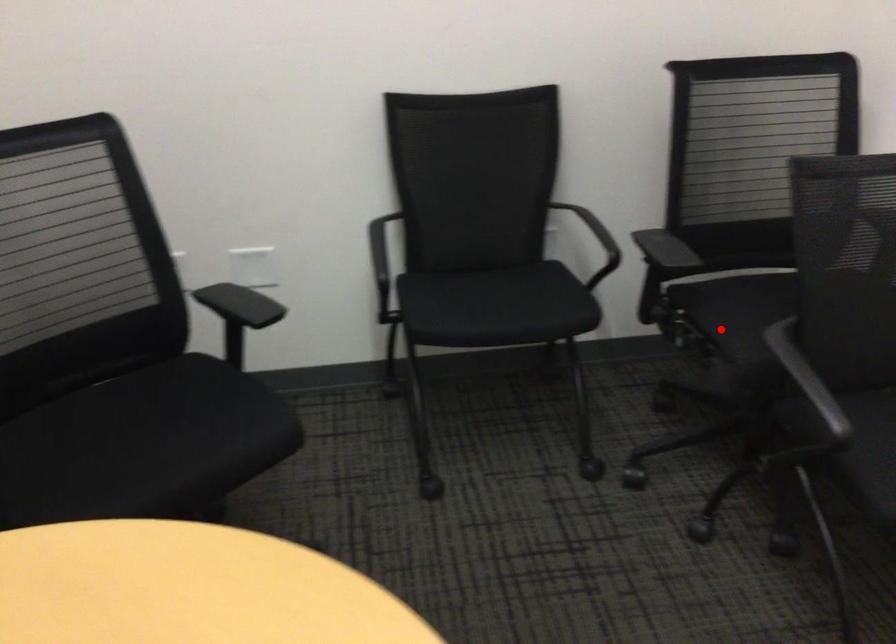
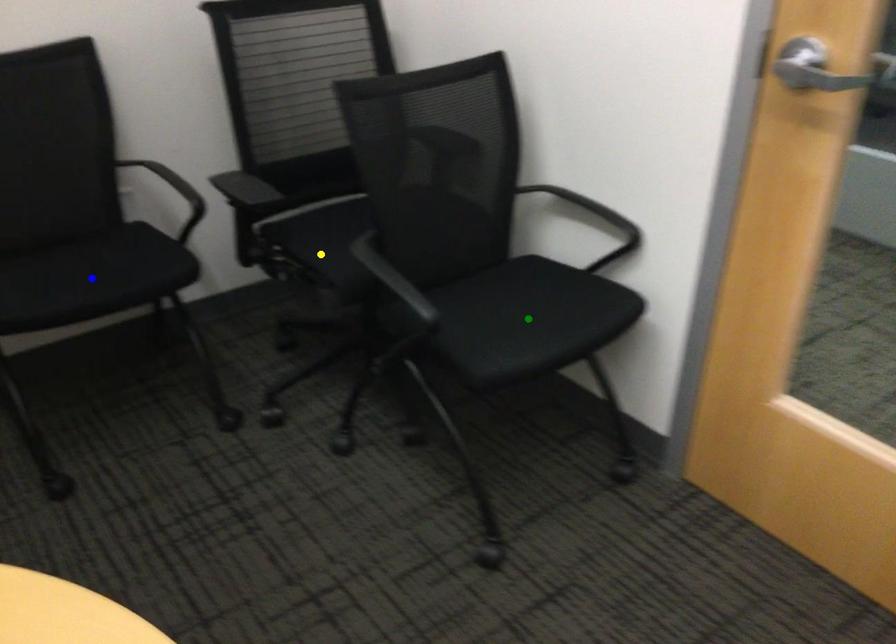
Question: I am providing you with two images of the same scene from different viewpoints. A red point is marked on the first image. You are given multiple points on the second image. Can you choose the point in image 2 that corresponds to the point in image 1?

Choices:
 (A) blue point
 (B) yellow point
 (C) green point

Answer: (B)